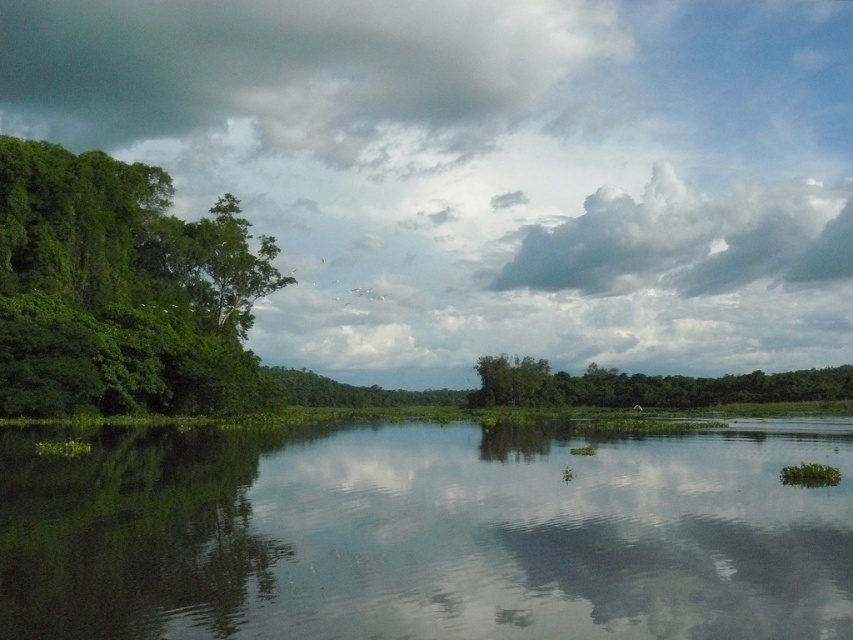
Is green reflective water at center positioned at the back of dark gray cloud at upper left?

No, it is in front of dark gray cloud at upper left.

Can you confirm if green reflective water at center is wider than dark gray cloud at upper left?

In fact, green reflective water at center might be narrower than dark gray cloud at upper left.

Identify the location of green reflective water at center. (426, 534).

Is green leafy tree at left to the right of green leafy tree at center from the viewer's perspective?

In fact, green leafy tree at left is to the left of green leafy tree at center.

Measure the distance between green leafy tree at left and green leafy tree at center.

→ green leafy tree at left and green leafy tree at center are 64.37 meters apart.

Locate an element on the screen. The image size is (853, 640). green leafy tree at left is located at coordinates (122, 289).

Does dark gray cloud at upper left have a larger size compared to green leafy tree at center?

Correct, dark gray cloud at upper left is larger in size than green leafy tree at center.

Between point (296, 83) and point (627, 390), which one is positioned in front?

Point (627, 390) is more forward.

Where is `dark gray cloud at upper left`? This screenshot has height=640, width=853. dark gray cloud at upper left is located at coordinates (294, 70).